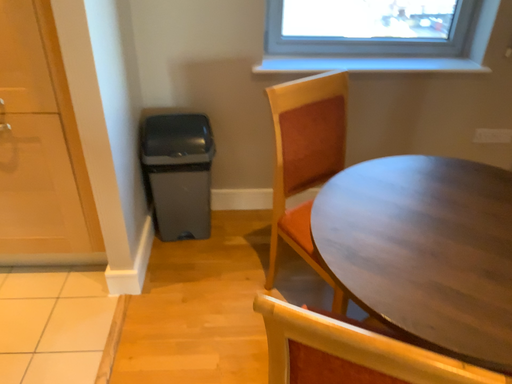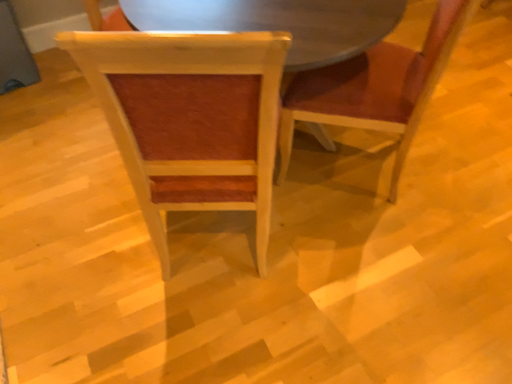
Question: How did the camera likely rotate when shooting the video?

Choices:
 (A) rotated left
 (B) rotated right

Answer: (B)